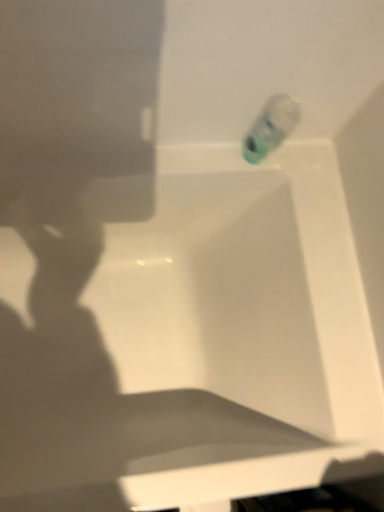
Question: Can you confirm if white glossy bathtub at upper center is bigger than translucent plastic bottle at upper right?

Choices:
 (A) no
 (B) yes

Answer: (B)

Question: Is white glossy bathtub at upper center far from translucent plastic bottle at upper right?

Choices:
 (A) no
 (B) yes

Answer: (A)

Question: Is white glossy bathtub at upper center at the left side of translucent plastic bottle at upper right?

Choices:
 (A) yes
 (B) no

Answer: (A)

Question: From the image's perspective, is white glossy bathtub at upper center located beneath translucent plastic bottle at upper right?

Choices:
 (A) no
 (B) yes

Answer: (B)

Question: Considering the relative sizes of white glossy bathtub at upper center and translucent plastic bottle at upper right in the image provided, is white glossy bathtub at upper center smaller than translucent plastic bottle at upper right?

Choices:
 (A) no
 (B) yes

Answer: (A)

Question: Is white glossy bathtub at upper center behind translucent plastic bottle at upper right?

Choices:
 (A) yes
 (B) no

Answer: (B)

Question: Does translucent plastic bottle at upper right have a lesser width compared to white glossy bathtub at upper center?

Choices:
 (A) no
 (B) yes

Answer: (B)

Question: Considering the relative sizes of translucent plastic bottle at upper right and white glossy bathtub at upper center in the image provided, is translucent plastic bottle at upper right smaller than white glossy bathtub at upper center?

Choices:
 (A) no
 (B) yes

Answer: (B)

Question: Does translucent plastic bottle at upper right have a greater height compared to white glossy bathtub at upper center?

Choices:
 (A) yes
 (B) no

Answer: (B)

Question: Is the depth of translucent plastic bottle at upper right less than that of white glossy bathtub at upper center?

Choices:
 (A) no
 (B) yes

Answer: (A)

Question: Is translucent plastic bottle at upper right turned away from white glossy bathtub at upper center?

Choices:
 (A) no
 (B) yes

Answer: (A)

Question: Are translucent plastic bottle at upper right and white glossy bathtub at upper center located far from each other?

Choices:
 (A) no
 (B) yes

Answer: (A)

Question: Is white glossy bathtub at upper center wider or thinner than translucent plastic bottle at upper right?

Choices:
 (A) wide
 (B) thin

Answer: (A)